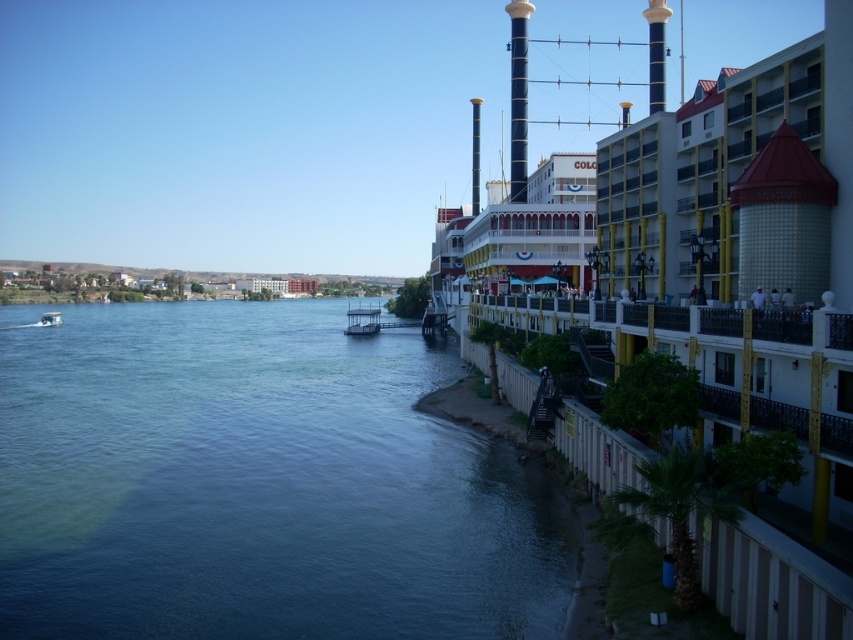
You are standing on the dock near the blue water at lower left and want to reach the white plastic boat at lower left. Which direction should you move to get closer to the boat?

Since the blue water at lower left is closer to the viewer than the white plastic boat at lower left, you should move away from the edge of the dock towards the boat, which is further out in the water.

You are standing on the dock and see the blue water at lower left and the white glossy boat at center. Which object is closer to your left side?

The blue water at lower left is closer to your left side since it is positioned to the left of the white glossy boat at center.